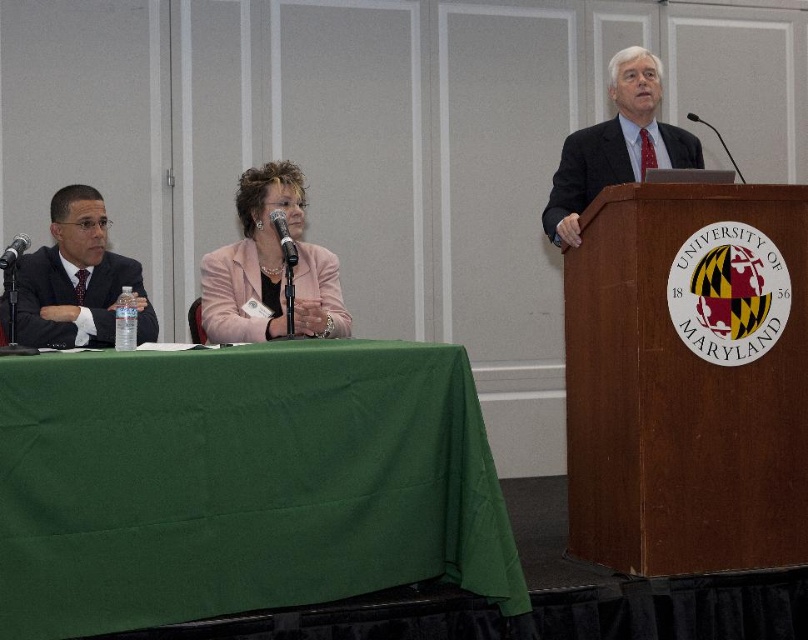
Is matte black suit at left thinner than metallic silver microphone at center?

No, matte black suit at left is not thinner than metallic silver microphone at center.

Consider the image. Which of these two, matte black suit at left or metallic silver microphone at center, stands shorter?

metallic silver microphone at center

The height and width of the screenshot is (640, 808). Describe the element at coordinates (78, 280) in the screenshot. I see `matte black suit at left` at that location.

In order to click on matte black suit at left in this screenshot , I will do `click(78, 280)`.

Between point (314, 314) and point (108, 333), which one is positioned in front?

Point (108, 333) is in front.

Can you confirm if pink fabric jacket at center is smaller than matte black suit at left?

Indeed, pink fabric jacket at center has a smaller size compared to matte black suit at left.

Does point (326, 253) come farther from viewer compared to point (51, 292)?

Yes, it is behind point (51, 292).

You are a GUI agent. You are given a task and a screenshot of the screen. Output one action in this format:
    pyautogui.click(x=<x>, y=<y>)
    Task: Click on the pink fabric jacket at center
    
    Given the screenshot: What is the action you would take?
    pyautogui.click(x=268, y=266)

Measure the distance from matte black suit at left to metallic silver microphone at left.

matte black suit at left and metallic silver microphone at left are 19.01 inches apart.

Who is taller, matte black suit at left or metallic silver microphone at left?

Standing taller between the two is matte black suit at left.

Does point (78, 218) lie in front of point (20, 243)?

That is False.

I want to click on matte black suit at left, so click(78, 280).